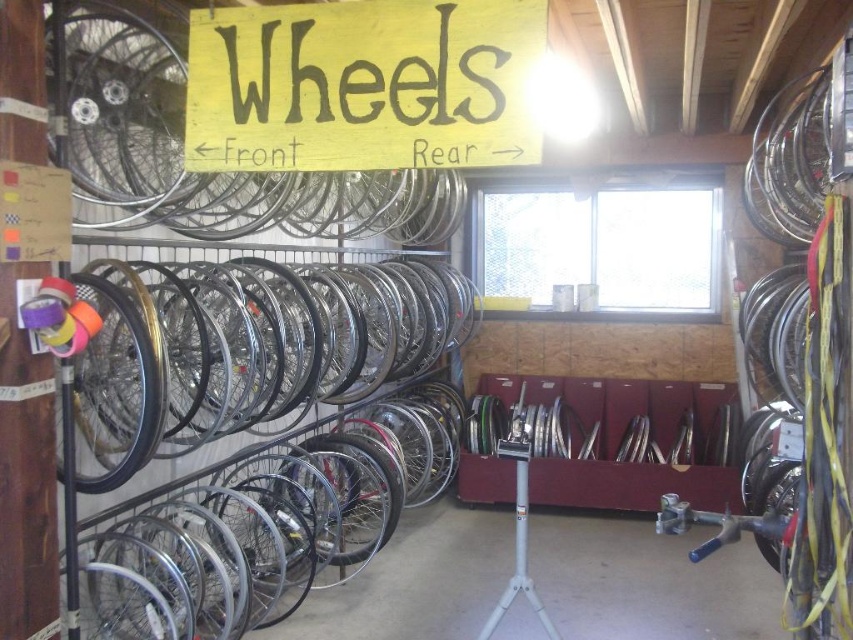
You are a customer looking for a specific bicycle wheel. You see the yellow wood sign at upper center and the gold metallic rim at left. Which object is positioned to the right side of the other?

The yellow wood sign at upper center is to the right of the gold metallic rim at left.

You are a customer looking for the section labeled by the yellow wood sign at upper center in the storage area. Where should you look to find this sign?

The yellow wood sign at upper center is located at point (x=363, y=84) in the image, so you should look there to find it.

You are standing in the storage area and want to reach both the point at coordinates (97, 48) and the point at coordinates (86, 381). Which point will be easier to reach first without moving your position?

The point at coordinates (97, 48) will be easier to reach first because it is closer to you compared to the point at coordinates (86, 381), which is further away.